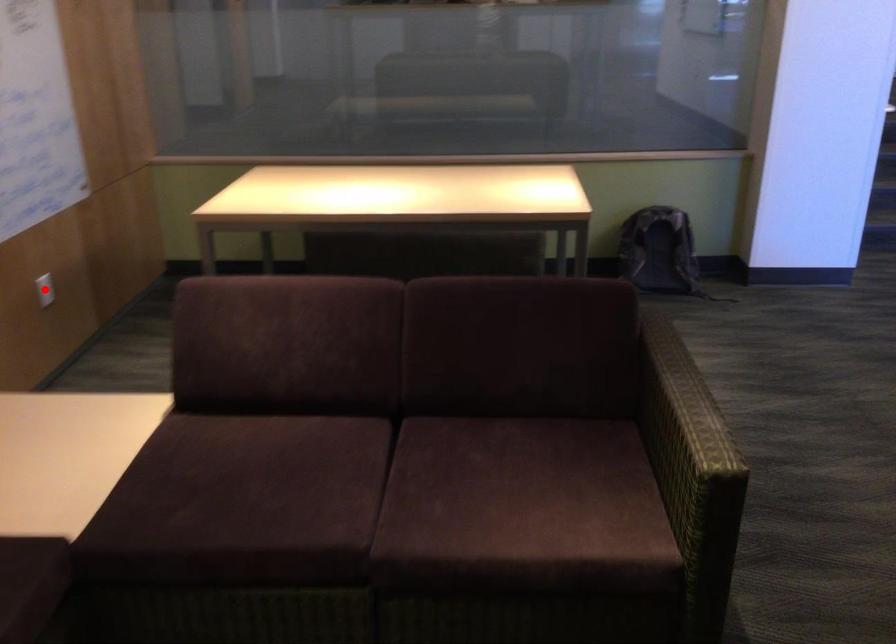
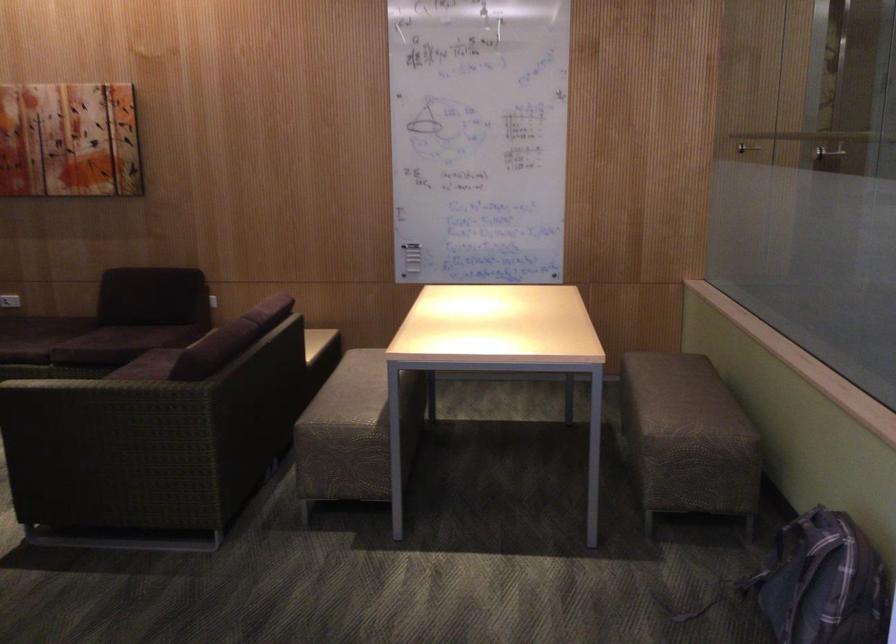
Question: I am providing you with two images of the same scene from different viewpoints. A red point is marked on the first image. Can you still see the location of the red point in image 2?

Choices:
 (A) Yes
 (B) No

Answer: (B)